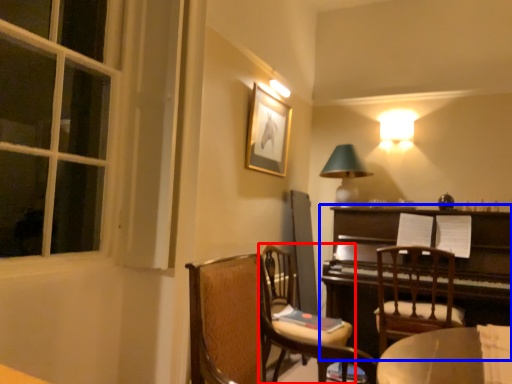
Question: Which object appears farthest to the camera in this image, chair (highlighted by a red box) or piano (highlighted by a blue box)?

Choices:
 (A) chair
 (B) piano

Answer: (B)